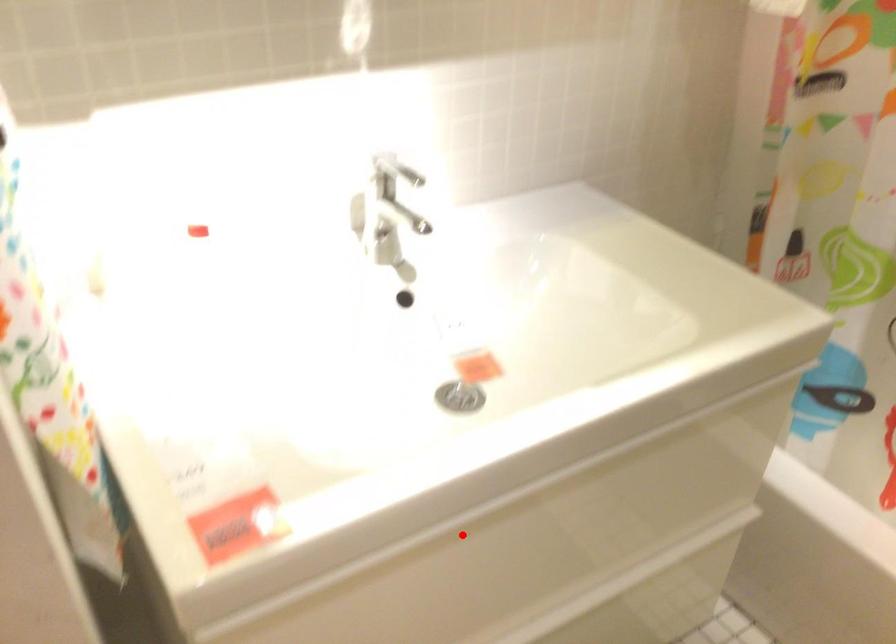
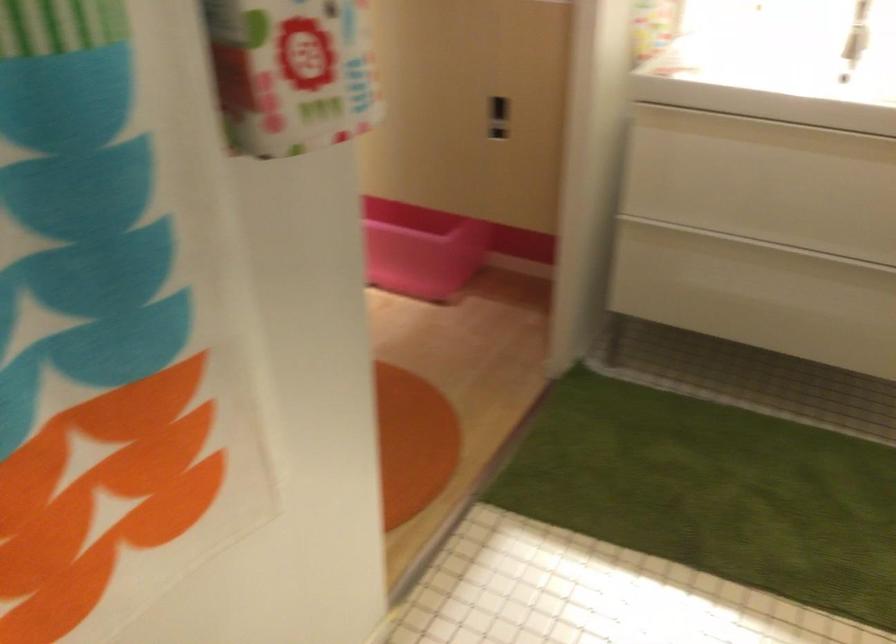
Find the pixel in the second image that matches the highlighted location in the first image.

(764, 131)